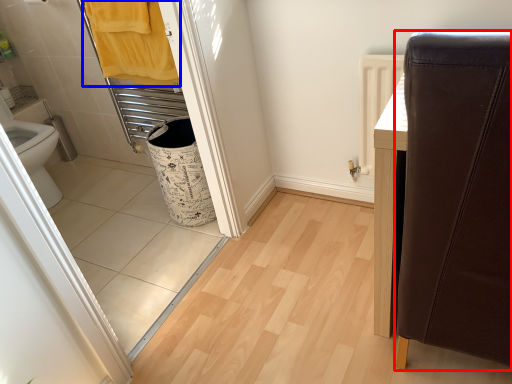
Question: Among these objects, which one is farthest to the camera, furniture (highlighted by a red box) or bath towel (highlighted by a blue box)?

Choices:
 (A) furniture
 (B) bath towel

Answer: (B)